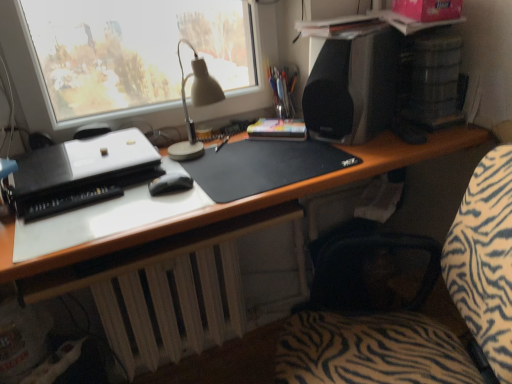
Locate an element on the screen. This screenshot has height=384, width=512. blank space situated above black plastic printer at left (from a real-world perspective) is located at coordinates (91, 160).